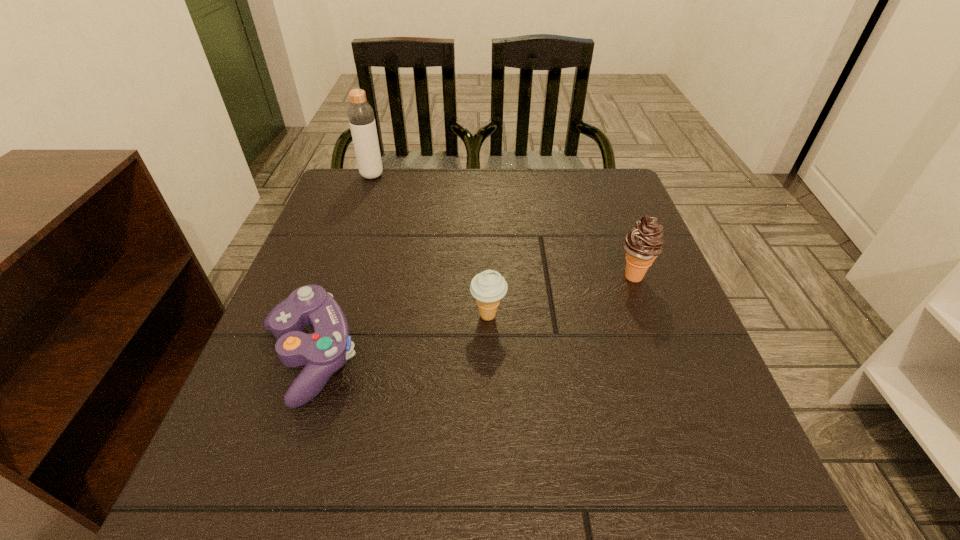
Locate an element on the screen. free location located on the right of the control is located at coordinates (581, 357).

Locate an element on the screen. This screenshot has width=960, height=540. object that is at the far edge is located at coordinates (361, 117).

Where is `bottle that is positioned at the left edge`? This screenshot has width=960, height=540. bottle that is positioned at the left edge is located at coordinates (361, 117).

You are a GUI agent. You are given a task and a screenshot of the screen. Output one action in this format:
    pyautogui.click(x=<x>, y=<y>)
    Task: Click on the control that is at the left edge
    This screenshot has width=960, height=540.
    Given the screenshot: What is the action you would take?
    pyautogui.click(x=325, y=351)

Find the location of a particular element. The height and width of the screenshot is (540, 960). object located in the right edge section of the desktop is located at coordinates (643, 243).

At what (x,y) coordinates should I click in order to perform the action: click on object that is at the far left corner. Please return your answer as a coordinate pair (x, y). This screenshot has width=960, height=540. Looking at the image, I should click on (361, 117).

In the image, there is a desktop. Where is `vacant space at the far edge`? vacant space at the far edge is located at coordinates (528, 175).

In the image, there is a desktop. At what (x,y) coordinates should I click in order to perform the action: click on vacant space at the near edge. Please return your answer as a coordinate pair (x, y). Looking at the image, I should click on (545, 514).

Locate an element on the screen. This screenshot has width=960, height=540. vacant space at the left edge of the desktop is located at coordinates (372, 222).

The image size is (960, 540). Identify the location of vacant space at the right edge of the desktop. (611, 316).